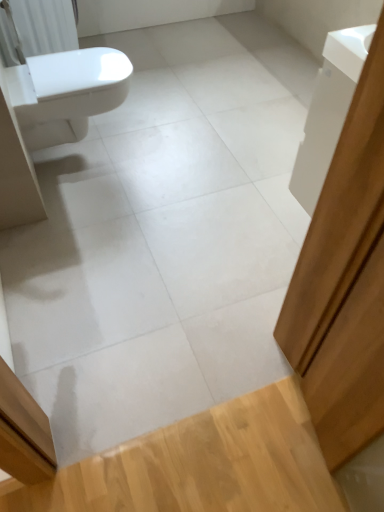
The width and height of the screenshot is (384, 512). Find the location of `spots to the right of white plastic radiator at upper left`. spots to the right of white plastic radiator at upper left is located at coordinates (144, 61).